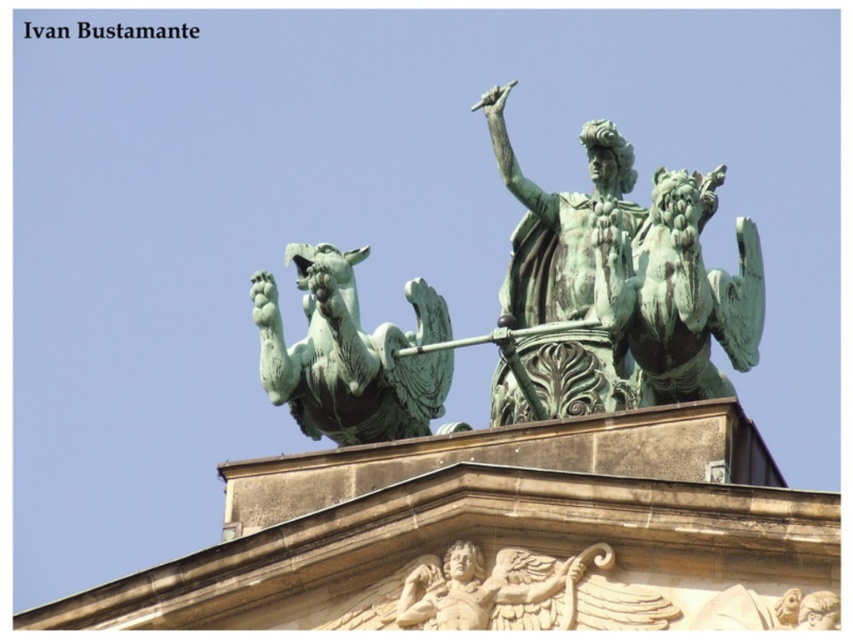
You are an art conservator examining the building facade. You notice the green patina statue at upper center and the green patina griffin at upper left. Which of these two objects is taller?

The green patina statue at upper center is taller than the green patina griffin at upper left according to the description.